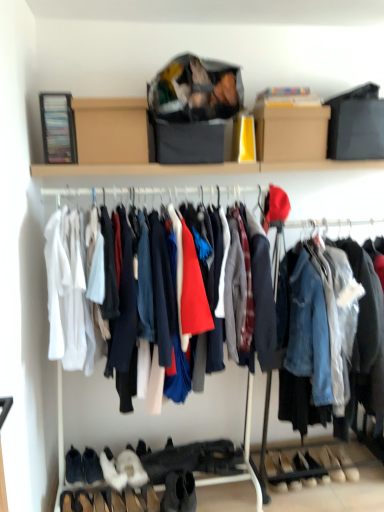
Question: From a real-world perspective, relative to white suede shoes at lower center, arranged as the sixth footwear when viewed from the left, is leather shoe at lower center, which is counted as the first shoe, starting from the right, vertically above or below?

Choices:
 (A) below
 (B) above

Answer: (B)

Question: Is leather shoe at lower center, which is counted as the first shoe, starting from the right, wider or thinner than white suede shoes at lower center, placed as the 3th footwear when sorted from right to left?

Choices:
 (A) wide
 (B) thin

Answer: (A)

Question: Estimate the real-world distances between objects in this image. Which object is farther from the leather shoe at lower center, the 2th shoe in the left-to-right sequence?

Choices:
 (A) white suede shoes at lower center, placed as the 3th footwear when sorted from right to left
 (B) black suede boot at lower center, which is counted as the 4th footwear, starting from the left
 (C) black suede boot at lower left, which appears as the 8th footwear when viewed from the right
 (D) white suede shoe at lower right, which ranks as the first footwear in right-to-left order
 (E) white suede sneakers at lower center, marked as the third footwear in a left-to-right arrangement

Answer: (C)

Question: Which object is the farthest from the leather shoe at lower center, the 2th shoe in the left-to-right sequence?

Choices:
 (A) cardboard box at upper center
 (B) black suede boot at lower center, which is the 5th footwear from right to left
 (C) white suede shoe at lower right, which ranks as the first footwear in right-to-left order
 (D) white suede boot at lower left, which is the second footwear in left-to-right order
 (E) leather shoes at lower center, the 5th footwear positioned from the left

Answer: (A)